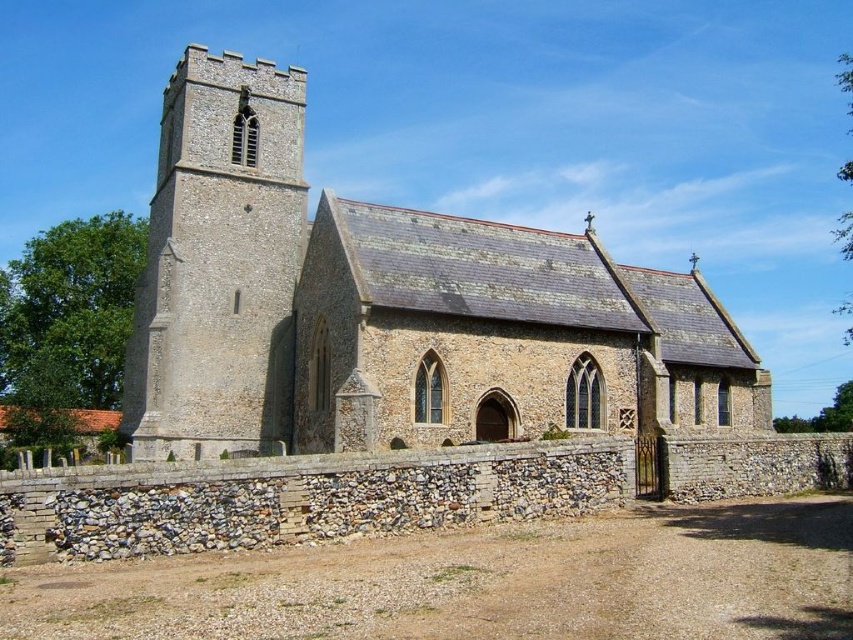
You are standing in front of the brown stone church at center and want to place a 2.5 meter wide decorative archway between it and the stone tower at upper left. Will there be enough space for the archway?

The brown stone church at center and the stone tower at upper left are 7.59 meters apart. Since the archway is 2.5 meters wide, there is sufficient space between them to place it without any issues.

You are standing in front of the church and notice two points marked on the tower. The first point is at coordinate point(248, 244) and the second is at point(270, 212). Which point is closer to you?

Point(248, 244) is closer to the viewer than point(270, 212).